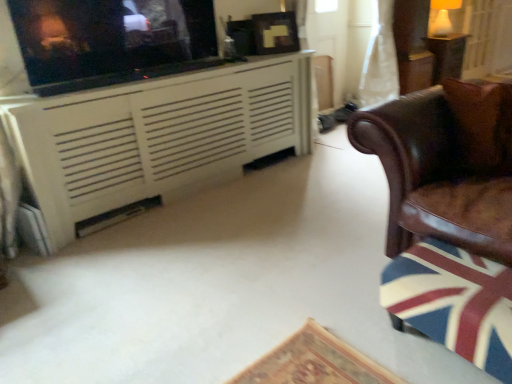
The width and height of the screenshot is (512, 384). Find the location of `white sheer curtain at upper right`. white sheer curtain at upper right is located at coordinates (380, 59).

What do you see at coordinates (442, 17) in the screenshot?
I see `white glossy lampshade at upper right` at bounding box center [442, 17].

Describe the element at coordinates (446, 55) in the screenshot. Image resolution: width=512 pixels, height=384 pixels. I see `wooden table at upper right` at that location.

In order to click on matte black tv at upper left in this screenshot , I will do pos(111,41).

Image resolution: width=512 pixels, height=384 pixels. Find the location of `white painted wood cabinet at upper left`. white painted wood cabinet at upper left is located at coordinates (154, 139).

The height and width of the screenshot is (384, 512). Identify the location of white sheer curtain at upper right. (380, 59).

Considering the sizes of objects brown leather pillow at right and matte black tv at upper left in the image provided, who is taller, brown leather pillow at right or matte black tv at upper left?

matte black tv at upper left.

Between brown leather pillow at right and matte black tv at upper left, which one has smaller width?

Thinner between the two is matte black tv at upper left.

From the picture: From a real-world perspective, does brown leather pillow at right sit lower than matte black tv at upper left?

Yes.

Is brown leather pillow at right aimed at matte black tv at upper left?

No, brown leather pillow at right is not turned towards matte black tv at upper left.

Can we say brown leather pillow at right lies outside wooden table at upper right?

Yes, brown leather pillow at right is not within wooden table at upper right.

Identify the location of pillow on the left of wooden table at upper right. (482, 123).

Is brown leather pillow at right in contact with wooden table at upper right?

No, brown leather pillow at right is not next to wooden table at upper right.

Does point (510, 141) come behind point (432, 77)?

That is False.

Between matte black tv at upper left and wooden table at upper right, which one appears on the right side from the viewer's perspective?

wooden table at upper right.

Are matte black tv at upper left and wooden table at upper right far apart?

Yes, matte black tv at upper left and wooden table at upper right are located far from each other.

Which of these two, matte black tv at upper left or wooden table at upper right, is bigger?

Bigger between the two is wooden table at upper right.

From the image's perspective, who appears lower, matte black tv at upper left or wooden table at upper right?

matte black tv at upper left, from the image's perspective.

Can you tell me how much matte black tv at upper left and white glossy lampshade at upper right differ in facing direction?

The angular difference between matte black tv at upper left and white glossy lampshade at upper right is 0.111 degrees.

Can you confirm if matte black tv at upper left is smaller than white glossy lampshade at upper right?

No, matte black tv at upper left is not smaller than white glossy lampshade at upper right.

Based on the photo, considering the relative positions of matte black tv at upper left and white glossy lampshade at upper right in the image provided, is matte black tv at upper left to the left of white glossy lampshade at upper right from the viewer's perspective?

Yes, matte black tv at upper left is to the left of white glossy lampshade at upper right.

Is matte black tv at upper left touching white glossy lampshade at upper right?

They are not placed beside each other.

Is white sheer curtain at upper right spatially inside brown leather pillow at right, or outside of it?

white sheer curtain at upper right is not inside brown leather pillow at right, it's outside.

From the image's perspective, which one is positioned higher, white sheer curtain at upper right or brown leather pillow at right?

From the image's view, white sheer curtain at upper right is above.

Measure the distance from white sheer curtain at upper right to brown leather pillow at right.

7.71 feet.

Who is smaller, white sheer curtain at upper right or brown leather pillow at right?

Smaller between the two is brown leather pillow at right.

Is brown leather chair at right further to camera compared to brown leather pillow at right?

No, brown leather chair at right is closer to the viewer.

Is brown leather chair at right wider than brown leather pillow at right?

Yes, brown leather chair at right is wider than brown leather pillow at right.

Locate an element on the screen. Image resolution: width=512 pixels, height=384 pixels. chair lying below the brown leather pillow at right (from the image's perspective) is located at coordinates (445, 165).

Is white painted wood cabinet at upper left smaller than brown leather pillow at right?

Incorrect, white painted wood cabinet at upper left is not smaller in size than brown leather pillow at right.

Consider the image. Is white painted wood cabinet at upper left placed right next to brown leather pillow at right?

They are not placed beside each other.

Is point (139, 174) behind point (471, 92)?

Yes, it is.

Where is `tv show located behind the brown leather pillow at right`? The image size is (512, 384). tv show located behind the brown leather pillow at right is located at coordinates (111, 41).

I want to click on pillow on the left of wooden table at upper right, so click(482, 123).

When comparing their distances from wooden swivel chair at right, does wooden table at upper right or white sheer curtain at upper right seem closer?

Based on the image, white sheer curtain at upper right appears to be nearer to wooden swivel chair at right.

From the picture: From the image, which object appears to be farther from matte black tv at upper left, white painted wood cabinet at upper left or wooden table at upper right?

wooden table at upper right is positioned further to the anchor matte black tv at upper left.

Looking at this image, looking at the image, which one is located further to white glossy lampshade at upper right, wooden swivel chair at right or white painted wood cabinet at upper left?

Among the two, wooden swivel chair at right is located further to white glossy lampshade at upper right.

When comparing their distances from white sheer curtain at upper right, does white glossy lampshade at upper right or brown leather pillow at right seem further?

Among the two, brown leather pillow at right is located further to white sheer curtain at upper right.

When comparing their distances from brown leather chair at right, does white painted wood cabinet at upper left or brown leather pillow at right seem further?

Among the two, white painted wood cabinet at upper left is located further to brown leather chair at right.

Estimate the real-world distances between objects in this image. Which object is closer to white painted wood cabinet at upper left, brown leather pillow at right or wooden table at upper right?

Among the two, brown leather pillow at right is located nearer to white painted wood cabinet at upper left.

When comparing their distances from wooden table at upper right, does white sheer curtain at upper right or matte black tv at upper left seem further?

Among the two, matte black tv at upper left is located further to wooden table at upper right.

Which object lies further to the anchor point wooden swivel chair at right, white sheer curtain at upper right or white painted wood cabinet at upper left?

white sheer curtain at upper right.

This screenshot has height=384, width=512. I want to click on cabinetry between matte black tv at upper left and wooden table at upper right in the horizontal direction, so click(154, 139).

The image size is (512, 384). Identify the location of swivel chair between white painted wood cabinet at upper left and brown leather pillow at right in the horizontal direction. (454, 302).

At what (x,y) coordinates should I click in order to perform the action: click on cabinetry between matte black tv at upper left and white sheer curtain at upper right from left to right. Please return your answer as a coordinate pair (x, y). The height and width of the screenshot is (384, 512). Looking at the image, I should click on (154, 139).

At what (x,y) coordinates should I click in order to perform the action: click on chair that lies between brown leather pillow at right and wooden swivel chair at right from top to bottom. Please return your answer as a coordinate pair (x, y). This screenshot has height=384, width=512. Looking at the image, I should click on (445, 165).